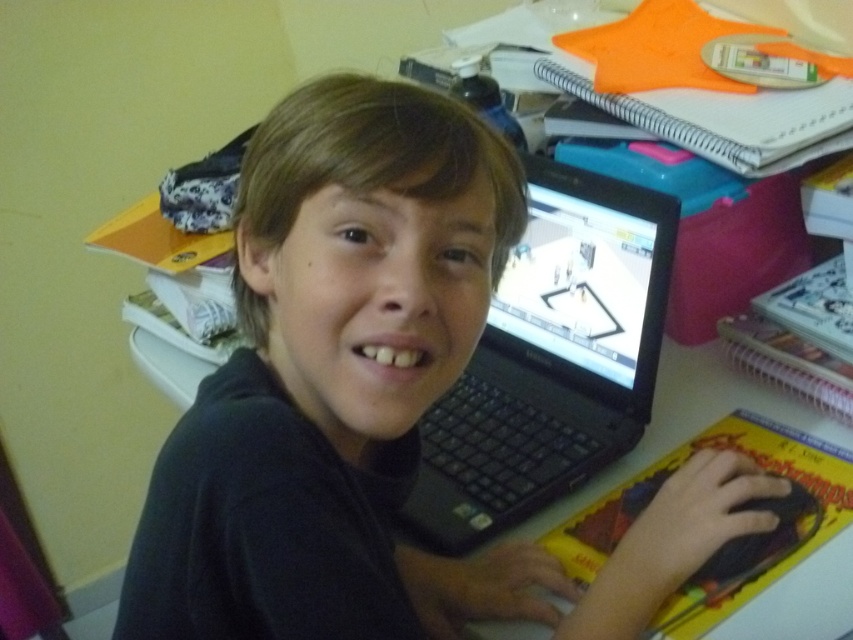
Which is above, black matte laptop at center or black plastic laptop at center?

black plastic laptop at center is above.

Does black matte laptop at center have a lesser width compared to black plastic laptop at center?

Incorrect, black matte laptop at center's width is not less than black plastic laptop at center's.

The image size is (853, 640). I want to click on black matte laptop at center, so click(x=373, y=401).